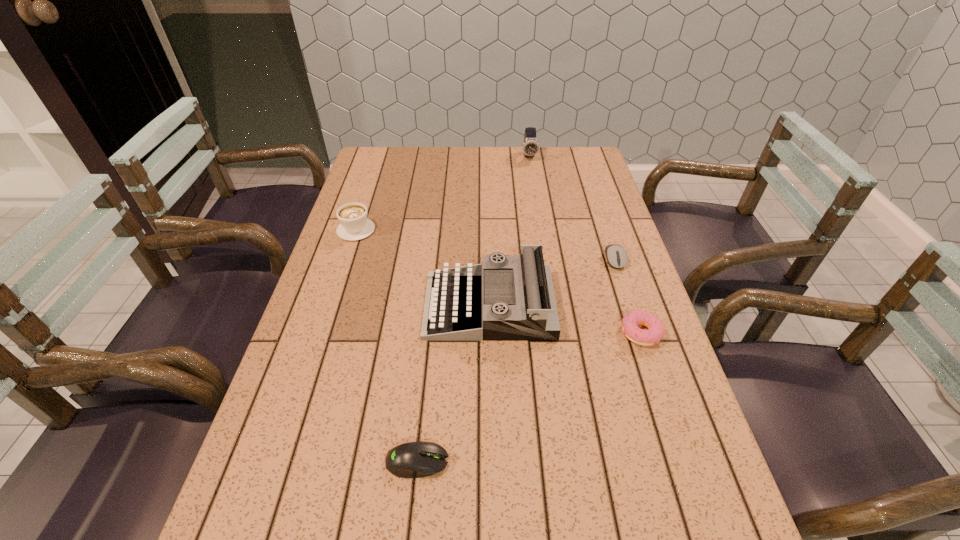
This screenshot has height=540, width=960. What are the coordinates of `free space located 0.210m on the typing side of the typewriter` in the screenshot? It's located at (342, 306).

I want to click on vacant space located 0.220m on the typing side of the typewriter, so click(x=338, y=306).

The width and height of the screenshot is (960, 540). I want to click on free space located 0.070m on the typing side of the typewriter, so click(x=397, y=306).

At what (x,y) coordinates should I click in order to perform the action: click on vacant space located to the right of the fourth shortest object's handle. Please return your answer as a coordinate pair (x, y). The image size is (960, 540). Looking at the image, I should click on (381, 154).

The height and width of the screenshot is (540, 960). I want to click on free point located to the right of the fourth shortest object's handle, so click(376, 167).

You are a GUI agent. You are given a task and a screenshot of the screen. Output one action in this format:
    pyautogui.click(x=<x>, y=<y>)
    Task: Click on the blank area located 0.060m to the right of the fourth shortest object's handle
    This screenshot has width=960, height=540.
    Given the screenshot: What is the action you would take?
    pyautogui.click(x=364, y=207)

Where is `vacant space located on the back of the doughnut`? The height and width of the screenshot is (540, 960). vacant space located on the back of the doughnut is located at coordinates tap(614, 253).

Identify the location of free space located on the wheel side of the right computer mouse. The image size is (960, 540). point(649,363).

Where is `vacant area situated 0.310m on the wheel side of the nearer computer mouse`? The height and width of the screenshot is (540, 960). vacant area situated 0.310m on the wheel side of the nearer computer mouse is located at coordinates (614, 461).

At what (x,y) coordinates should I click in order to perform the action: click on object present at the far edge. Please return your answer as a coordinate pair (x, y). The width and height of the screenshot is (960, 540). Looking at the image, I should click on (530, 147).